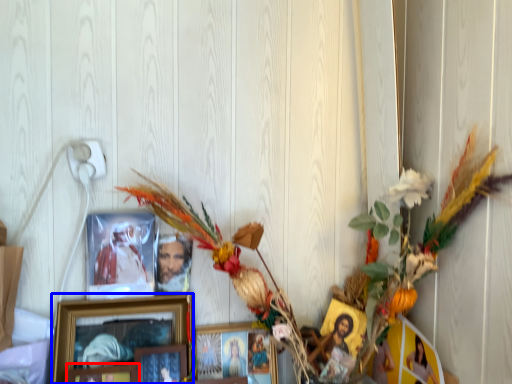
Question: Which object appears closest to the camera in this image, picture frame (highlighted by a red box) or picture frame (highlighted by a blue box)?

Choices:
 (A) picture frame
 (B) picture frame

Answer: (A)